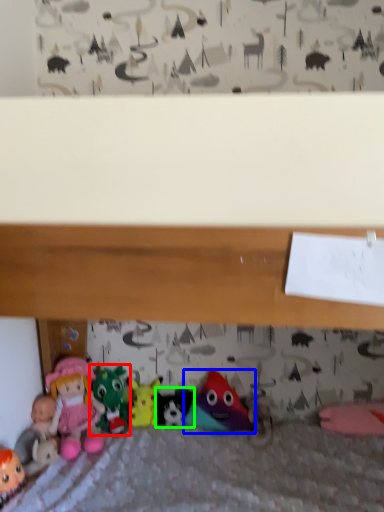
Question: Based on their relative distances, which object is farther from toy (highlighted by a red box)? Choose from toy (highlighted by a blue box) and toy (highlighted by a green box).

Choices:
 (A) toy
 (B) toy

Answer: (A)